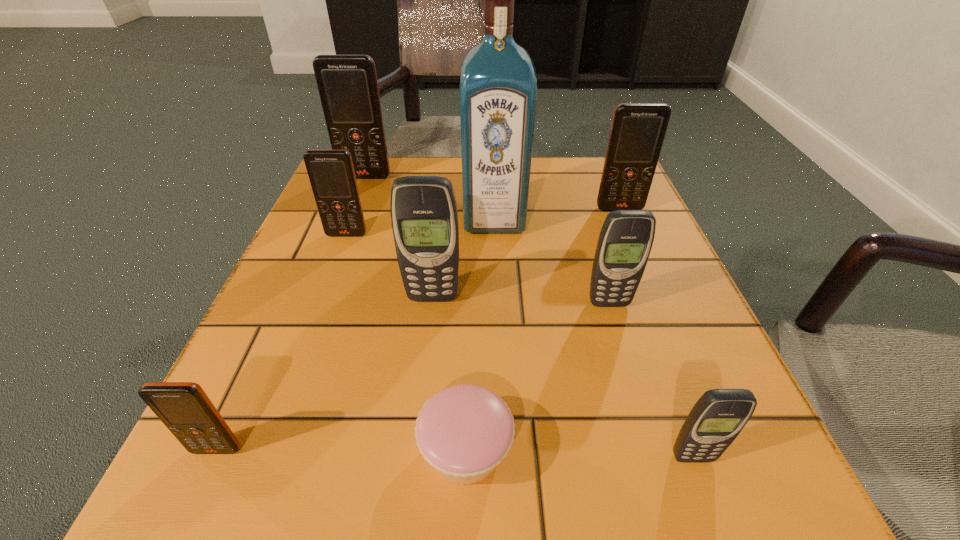
This screenshot has width=960, height=540. I want to click on liquor, so click(x=498, y=85).

Where is `the tallest object`? the tallest object is located at coordinates (498, 85).

Identify the location of the tallest cellular telephone. (347, 84).

Locate an element on the screen. the farthest object is located at coordinates (347, 84).

Find the location of a particular element. The height and width of the screenshot is (540, 960). the second biggest orange cellular telephone is located at coordinates (638, 130).

Where is `the second farthest cellular telephone`? The height and width of the screenshot is (540, 960). the second farthest cellular telephone is located at coordinates (638, 130).

Locate an element on the screen. the leftmost gray cellular telephone is located at coordinates (424, 216).

This screenshot has width=960, height=540. I want to click on the fourth cellular telephone from right to left, so (x=424, y=216).

Identify the location of the second smallest gray cellular telephone. (626, 238).

The width and height of the screenshot is (960, 540). Find the location of `the fifth nearest cellular telephone`. the fifth nearest cellular telephone is located at coordinates (331, 173).